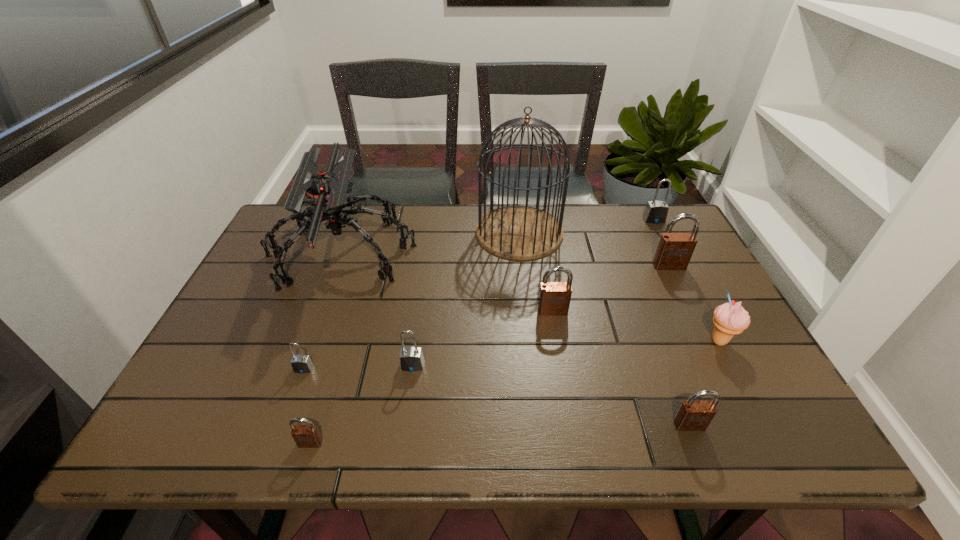
Identify the location of drone that is at the far edge. This screenshot has width=960, height=540. (326, 192).

Image resolution: width=960 pixels, height=540 pixels. Find the location of `padlock located in the far edge section of the desktop`. padlock located in the far edge section of the desktop is located at coordinates (655, 212).

This screenshot has width=960, height=540. Identify the location of object located at the left edge. (326, 192).

Where is `icecream at the right edge`? Image resolution: width=960 pixels, height=540 pixels. icecream at the right edge is located at coordinates (731, 318).

Find the location of a particular element. The width and height of the screenshot is (960, 540). object that is positioned at the far left corner is located at coordinates (326, 192).

This screenshot has height=540, width=960. I want to click on object positioned at the far right corner, so click(655, 212).

In the image, there is a desktop. Where is `free space at the far edge`? Image resolution: width=960 pixels, height=540 pixels. free space at the far edge is located at coordinates (466, 206).

The width and height of the screenshot is (960, 540). In the image, there is a desktop. Identify the location of vacant space at the near edge. (373, 429).

Image resolution: width=960 pixels, height=540 pixels. In the image, there is a desktop. Find the location of `vacant space at the left edge`. vacant space at the left edge is located at coordinates (x=268, y=268).

Image resolution: width=960 pixels, height=540 pixels. Identify the location of free space at the right edge of the desktop. (707, 269).